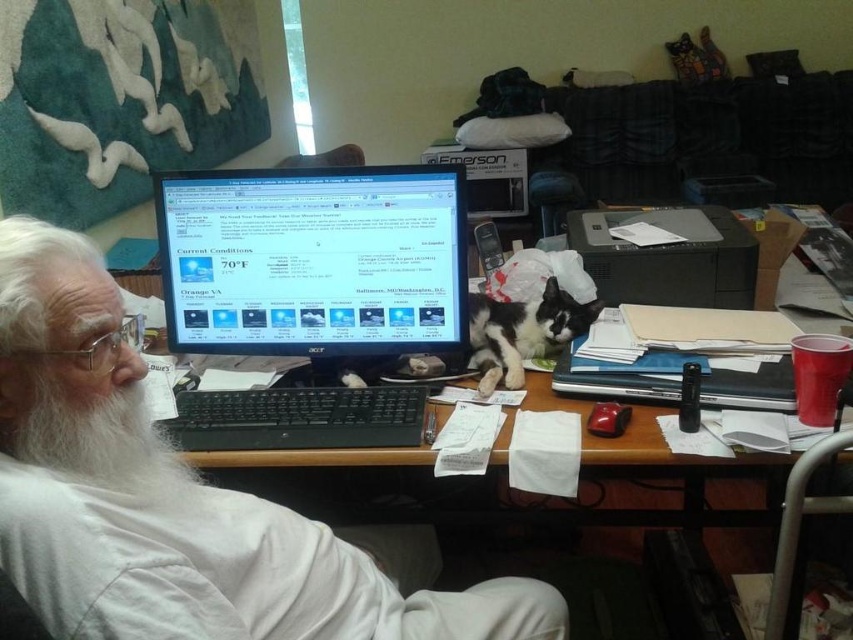
Question: Does white cotton shirt at center have a greater width compared to black glossy monitor at center?

Choices:
 (A) no
 (B) yes

Answer: (B)

Question: Is white cotton shirt at center above white fluffy beard at left?

Choices:
 (A) no
 (B) yes

Answer: (A)

Question: Which of the following is the closest to the observer?

Choices:
 (A) (189, 232)
 (B) (113, 406)

Answer: (B)

Question: From the image, what is the correct spatial relationship of white cotton shirt at center in relation to white fluffy beard at left?

Choices:
 (A) right
 (B) left

Answer: (A)

Question: Considering the real-world distances, which object is farthest from the black glossy monitor at center?

Choices:
 (A) white cotton shirt at center
 (B) white fluffy beard at left

Answer: (A)

Question: Which is farther from the black glossy monitor at center?

Choices:
 (A) white fluffy beard at left
 (B) white cotton shirt at center

Answer: (B)